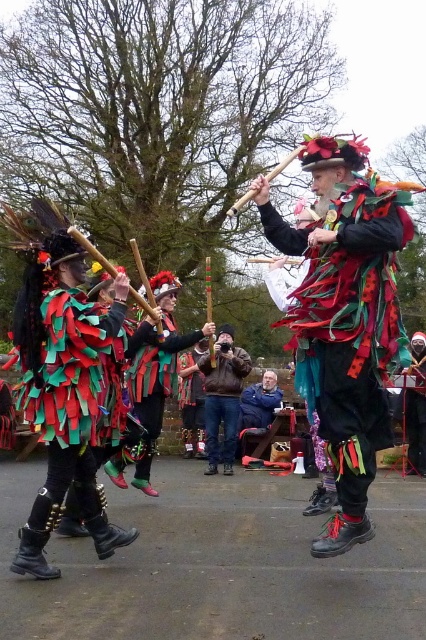
You are a photographer trying to capture the entire group in one photo. The shiny metallic costume at center and green fabric mask at center are both important subjects. Based on their sizes, which one might require more space in the frame to ensure it is fully visible?

The shiny metallic costume at center might require more space in the frame since it is wider than the green fabric mask at center according to the description.